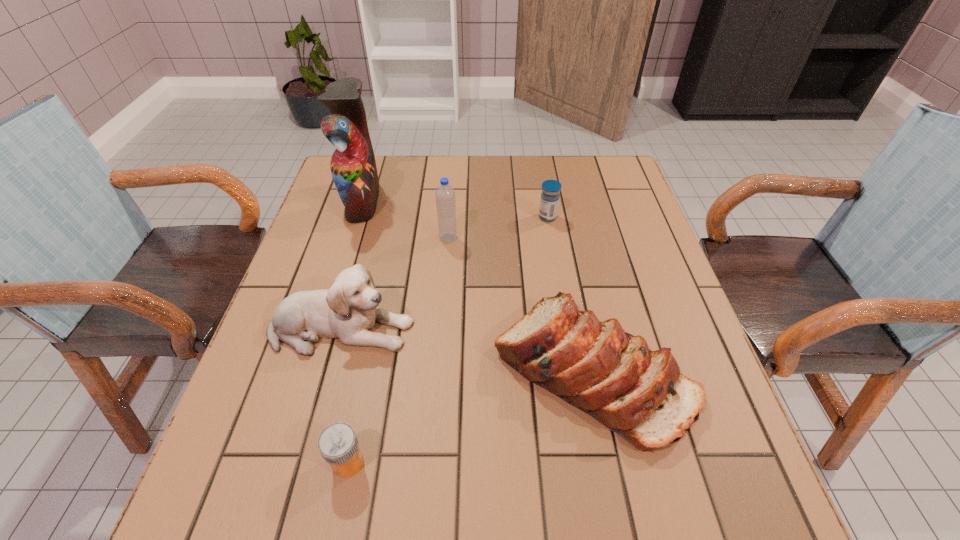
Locate an element on the screen. The height and width of the screenshot is (540, 960). the tallest object is located at coordinates 353,167.

Locate an element on the screen. This screenshot has width=960, height=540. water bottle is located at coordinates (445, 195).

You are a GUI agent. You are given a task and a screenshot of the screen. Output one action in this format:
    pyautogui.click(x=<x>, y=<y>)
    Task: Click on the fourth object from left to right
    The height and width of the screenshot is (540, 960).
    Given the screenshot: What is the action you would take?
    click(445, 195)

Identify the location of puppy. (348, 310).

I want to click on the fourth tallest object, so click(613, 376).

Where is `the right medicine`? This screenshot has height=540, width=960. the right medicine is located at coordinates (549, 201).

The height and width of the screenshot is (540, 960). In order to click on the farther medicine in this screenshot , I will do `click(549, 201)`.

Locate an element on the screen. This screenshot has width=960, height=540. the nearer medicine is located at coordinates (338, 444).

Find the location of `the shortest object`. the shortest object is located at coordinates (338, 444).

The image size is (960, 540). I want to click on blank space located at the face of the parrot, so click(x=423, y=200).